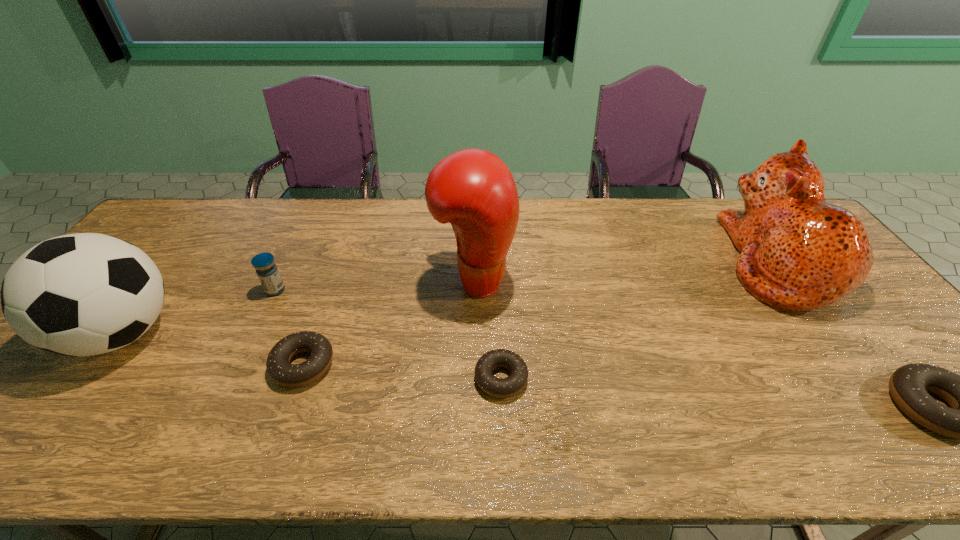
To achieve even spacing by inserting another doughnut among them, please point to a vacant spot for this new doughnut. Please provide its 2D coordinates. Your answer should be formatted as a tuple, i.e. [(x, y)], where the tuple contains the x and y coordinates of a point satisfying the conditions above.

[(709, 392)]